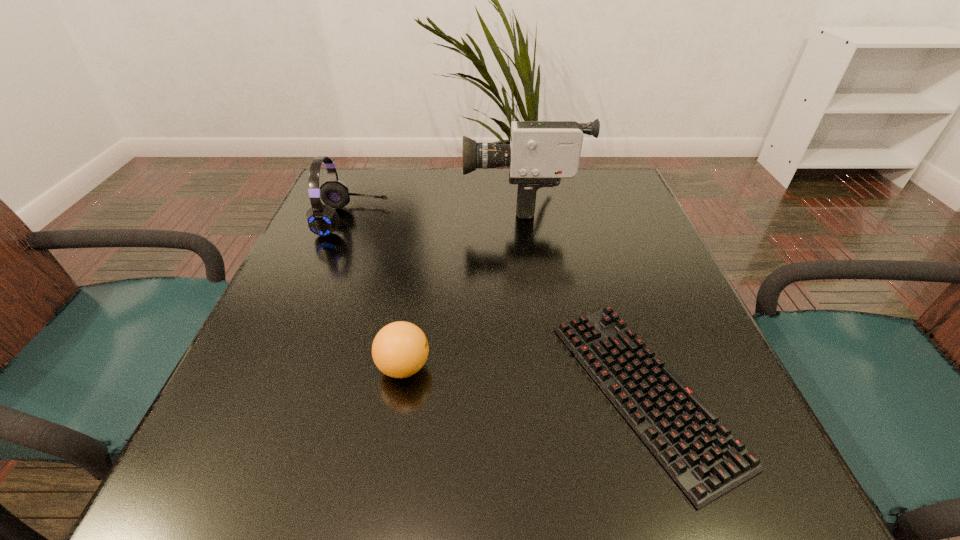
You are a GUI agent. You are given a task and a screenshot of the screen. Output one action in this format:
    pyautogui.click(x=<x>, y=<y>)
    Task: Click on the tallest object
    This screenshot has width=960, height=540.
    Given the screenshot: What is the action you would take?
    pyautogui.click(x=540, y=153)

This screenshot has height=540, width=960. Identify the location of headset. (323, 220).

In order to click on the third shortest object in this screenshot , I will do `click(323, 220)`.

The image size is (960, 540). In order to click on the third tallest object in this screenshot , I will do `click(400, 349)`.

The image size is (960, 540). What are the coordinates of `the third object from right to left` in the screenshot? It's located at (400, 349).

At what (x,y) coordinates should I click in order to perform the action: click on computer keyboard. Please return your answer as a coordinate pair (x, y). The image size is (960, 540). Looking at the image, I should click on (700, 453).

Find the location of a particular element. vacant space located 0.280m on the recording direction of the tallest object is located at coordinates (355, 200).

Find the location of a particular element. This screenshot has height=540, width=960. free space located 0.220m on the recording direction of the tallest object is located at coordinates pos(379,200).

Identify the location of free space located 0.200m on the recording direction of the tallest object. (387, 200).

Find the location of `vacant position located on the ear cushions of the leftmost object`. vacant position located on the ear cushions of the leftmost object is located at coordinates (489, 220).